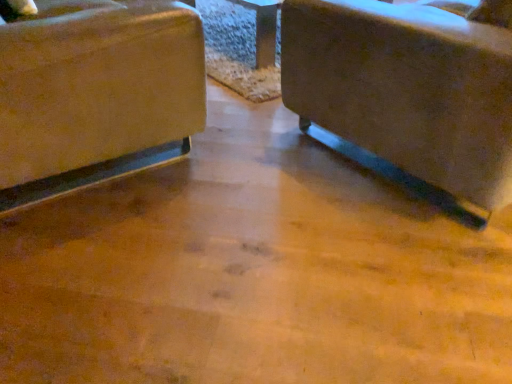
In order to click on matte beige fabric chair at left, which is counted as the 2th chair, starting from the right in this screenshot , I will do `click(96, 93)`.

The height and width of the screenshot is (384, 512). What do you see at coordinates (96, 93) in the screenshot? I see `matte beige fabric chair at left, marked as the 1th chair in a left-to-right arrangement` at bounding box center [96, 93].

Image resolution: width=512 pixels, height=384 pixels. What do you see at coordinates (406, 94) in the screenshot? I see `matte brown chair at center, marked as the 1th chair in a right-to-left arrangement` at bounding box center [406, 94].

Find the location of a particular element. This screenshot has width=512, height=384. matte brown chair at center, arranged as the 2th chair when viewed from the left is located at coordinates (406, 94).

Locate an element on the screen. matte beige fabric chair at left, marked as the 1th chair in a left-to-right arrangement is located at coordinates (96, 93).

Is matte brown chair at center, marked as the 1th chair in a right-to-left arrangement, to the left or to the right of matte beige fabric chair at left, which is counted as the 2th chair, starting from the right, in the image?

From the image, it's evident that matte brown chair at center, marked as the 1th chair in a right-to-left arrangement, is to the right of matte beige fabric chair at left, which is counted as the 2th chair, starting from the right.

Considering the relative positions of matte brown chair at center, arranged as the 2th chair when viewed from the left, and matte beige fabric chair at left, which is counted as the 2th chair, starting from the right, in the image provided, is matte brown chair at center, arranged as the 2th chair when viewed from the left, in front of matte beige fabric chair at left, which is counted as the 2th chair, starting from the right,?

Yes, it is.

Is point (453, 13) positioned behind point (51, 90)?

That is True.

From the image's perspective, is matte brown chair at center, arranged as the 2th chair when viewed from the left, positioned above or below matte beige fabric chair at left, marked as the 1th chair in a left-to-right arrangement?

matte brown chair at center, arranged as the 2th chair when viewed from the left, is situated lower than matte beige fabric chair at left, marked as the 1th chair in a left-to-right arrangement, in the image.

From a real-world perspective, is matte brown chair at center, arranged as the 2th chair when viewed from the left, physically above matte beige fabric chair at left, marked as the 1th chair in a left-to-right arrangement?

Yes, from a real-world perspective, matte brown chair at center, arranged as the 2th chair when viewed from the left, is over matte beige fabric chair at left, marked as the 1th chair in a left-to-right arrangement

Considering the sizes of matte brown chair at center, marked as the 1th chair in a right-to-left arrangement, and matte beige fabric chair at left, which is counted as the 2th chair, starting from the right, in the image, is matte brown chair at center, marked as the 1th chair in a right-to-left arrangement, wider or thinner than matte beige fabric chair at left, which is counted as the 2th chair, starting from the right,?

Considering their sizes, matte brown chair at center, marked as the 1th chair in a right-to-left arrangement, looks broader than matte beige fabric chair at left, which is counted as the 2th chair, starting from the right.

Can you confirm if matte brown chair at center, marked as the 1th chair in a right-to-left arrangement, is taller than matte beige fabric chair at left, which is counted as the 2th chair, starting from the right?

No.

Who is bigger, matte brown chair at center, marked as the 1th chair in a right-to-left arrangement, or matte beige fabric chair at left, marked as the 1th chair in a left-to-right arrangement?

With larger size is matte brown chair at center, marked as the 1th chair in a right-to-left arrangement.

Is matte beige fabric chair at left, which is counted as the 2th chair, starting from the right, a part of matte brown chair at center, arranged as the 2th chair when viewed from the left?

No.

Is matte brown chair at center, marked as the 1th chair in a right-to-left arrangement, touching matte beige fabric chair at left, which is counted as the 2th chair, starting from the right?

There is a gap between matte brown chair at center, marked as the 1th chair in a right-to-left arrangement, and matte beige fabric chair at left, which is counted as the 2th chair, starting from the right.

Is matte brown chair at center, arranged as the 2th chair when viewed from the left, facing towards matte beige fabric chair at left, which is counted as the 2th chair, starting from the right?

No, matte brown chair at center, arranged as the 2th chair when viewed from the left, does not turn towards matte beige fabric chair at left, which is counted as the 2th chair, starting from the right.

Can you tell me how much matte brown chair at center, marked as the 1th chair in a right-to-left arrangement, and matte beige fabric chair at left, marked as the 1th chair in a left-to-right arrangement, differ in facing direction?

There is a 92.4-degree angle between the facing directions of matte brown chair at center, marked as the 1th chair in a right-to-left arrangement, and matte beige fabric chair at left, marked as the 1th chair in a left-to-right arrangement.

Measure the distance from matte brown chair at center, marked as the 1th chair in a right-to-left arrangement, to matte beige fabric chair at left, which is counted as the 2th chair, starting from the right.

A distance of 27.69 inches exists between matte brown chair at center, marked as the 1th chair in a right-to-left arrangement, and matte beige fabric chair at left, which is counted as the 2th chair, starting from the right.

Image resolution: width=512 pixels, height=384 pixels. Identify the location of chair directly beneath the matte brown chair at center, marked as the 1th chair in a right-to-left arrangement (from a real-world perspective). (x=96, y=93).

Visually, is matte beige fabric chair at left, which is counted as the 2th chair, starting from the right, positioned to the left or to the right of matte brown chair at center, marked as the 1th chair in a right-to-left arrangement?

From the image, it's evident that matte beige fabric chair at left, which is counted as the 2th chair, starting from the right, is to the left of matte brown chair at center, marked as the 1th chair in a right-to-left arrangement.

Is matte beige fabric chair at left, marked as the 1th chair in a left-to-right arrangement, positioned behind matte brown chair at center, marked as the 1th chair in a right-to-left arrangement?

Yes, matte beige fabric chair at left, marked as the 1th chair in a left-to-right arrangement, is behind matte brown chair at center, marked as the 1th chair in a right-to-left arrangement.

Is point (76, 31) in front of point (437, 164)?

Yes, it is in front of point (437, 164).

From the image's perspective, which one is positioned higher, matte beige fabric chair at left, marked as the 1th chair in a left-to-right arrangement, or matte brown chair at center, marked as the 1th chair in a right-to-left arrangement?

matte beige fabric chair at left, marked as the 1th chair in a left-to-right arrangement, from the image's perspective.

From a real-world perspective, is matte beige fabric chair at left, marked as the 1th chair in a left-to-right arrangement, located beneath matte brown chair at center, marked as the 1th chair in a right-to-left arrangement?

Yes.

Is matte beige fabric chair at left, marked as the 1th chair in a left-to-right arrangement, wider than matte brown chair at center, marked as the 1th chair in a right-to-left arrangement?

Incorrect, the width of matte beige fabric chair at left, marked as the 1th chair in a left-to-right arrangement, does not surpass that of matte brown chair at center, marked as the 1th chair in a right-to-left arrangement.

Between matte beige fabric chair at left, marked as the 1th chair in a left-to-right arrangement, and matte brown chair at center, arranged as the 2th chair when viewed from the left, which one has more height?

matte beige fabric chair at left, marked as the 1th chair in a left-to-right arrangement, is taller.

Is matte beige fabric chair at left, which is counted as the 2th chair, starting from the right, smaller than matte brown chair at center, arranged as the 2th chair when viewed from the left?

Indeed, matte beige fabric chair at left, which is counted as the 2th chair, starting from the right, has a smaller size compared to matte brown chair at center, arranged as the 2th chair when viewed from the left.

Is matte beige fabric chair at left, which is counted as the 2th chair, starting from the right, outside of matte brown chair at center, marked as the 1th chair in a right-to-left arrangement?

That's correct, matte beige fabric chair at left, which is counted as the 2th chair, starting from the right, is outside of matte brown chair at center, marked as the 1th chair in a right-to-left arrangement.

Is matte beige fabric chair at left, marked as the 1th chair in a left-to-right arrangement, far away from matte brown chair at center, marked as the 1th chair in a right-to-left arrangement?

matte beige fabric chair at left, marked as the 1th chair in a left-to-right arrangement, is near matte brown chair at center, marked as the 1th chair in a right-to-left arrangement, not far away.

Is matte beige fabric chair at left, which is counted as the 2th chair, starting from the right, aimed at matte brown chair at center, marked as the 1th chair in a right-to-left arrangement?

Yes, matte beige fabric chair at left, which is counted as the 2th chair, starting from the right, faces towards matte brown chair at center, marked as the 1th chair in a right-to-left arrangement.

How many degrees apart are the facing directions of matte beige fabric chair at left, which is counted as the 2th chair, starting from the right, and matte brown chair at center, arranged as the 2th chair when viewed from the left?

The angle between the facing direction of matte beige fabric chair at left, which is counted as the 2th chair, starting from the right, and the facing direction of matte brown chair at center, arranged as the 2th chair when viewed from the left, is 92.4 degrees.

Identify the location of chair that is below the matte beige fabric chair at left, which is counted as the 2th chair, starting from the right (from the image's perspective). This screenshot has width=512, height=384. (406, 94).

The image size is (512, 384). In order to click on chair above the matte beige fabric chair at left, marked as the 1th chair in a left-to-right arrangement (from a real-world perspective) in this screenshot , I will do `click(406, 94)`.

This screenshot has height=384, width=512. I want to click on chair beneath the matte brown chair at center, arranged as the 2th chair when viewed from the left (from a real-world perspective), so click(96, 93).